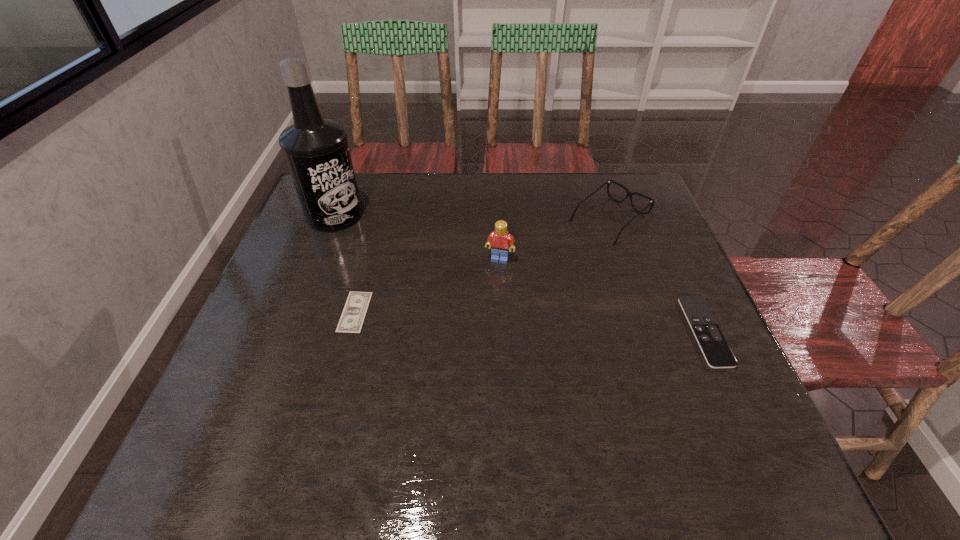
Locate an element on the screen. The height and width of the screenshot is (540, 960). free space on the desktop that is between the second object from left to right and the remote control and is positioned with the lenses facing outward on the third shortest object is located at coordinates (478, 319).

Where is `vacant space on the desktop that is between the shortest object and the second shortest object and is positioned on the front label of the liquor`? The width and height of the screenshot is (960, 540). vacant space on the desktop that is between the shortest object and the second shortest object and is positioned on the front label of the liquor is located at coordinates (517, 321).

The height and width of the screenshot is (540, 960). I want to click on vacant space on the desktop that is between the second object from left to right and the remote control and is positioned on the front-facing side of the fourth shortest object, so click(482, 319).